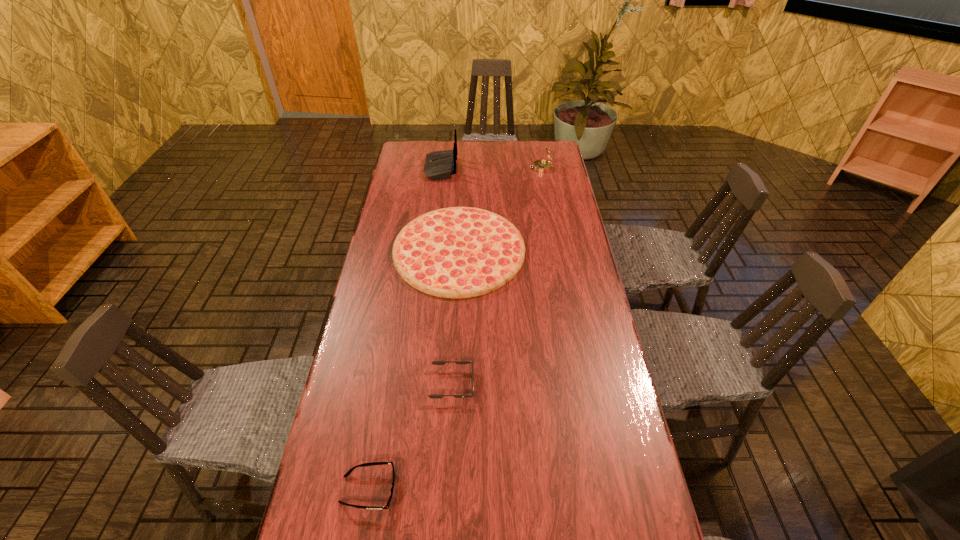
This screenshot has width=960, height=540. I want to click on blank space that satisfies the following two spatial constraints: 1. on the back of the router; 2. on the left side of the pizza, so click(x=431, y=251).